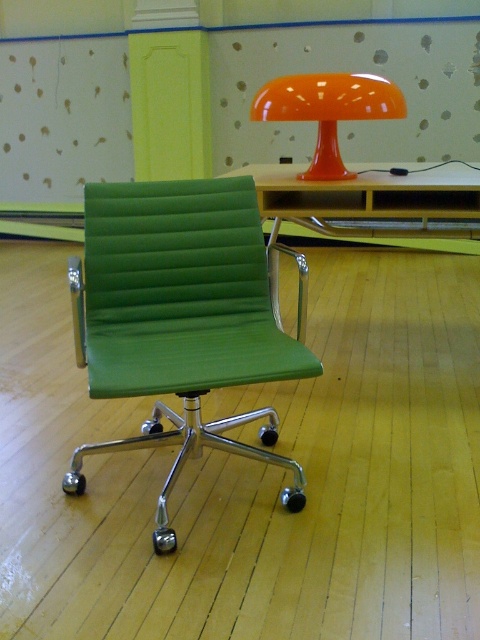
You are an office worker who needs to adjust your workspace for a meeting. You want to ensure that the green leather chair at center is visible to all attendees seated around the light wood table at center. Based on their heights, will the chair back obstruct the view from the table?

The green leather chair at center is taller than the light wood table at center, so the chair back may obstruct the view from the table since it is taller than the table.

In the scene shown: You are standing at point 0.5, 0.5 in the room. Which direction should you move to reach the green leather chair at center?

Since the green leather chair at center is located at point (180, 317), which is slightly to the left and below your current position at (240, 320), you should move southwest to reach it.